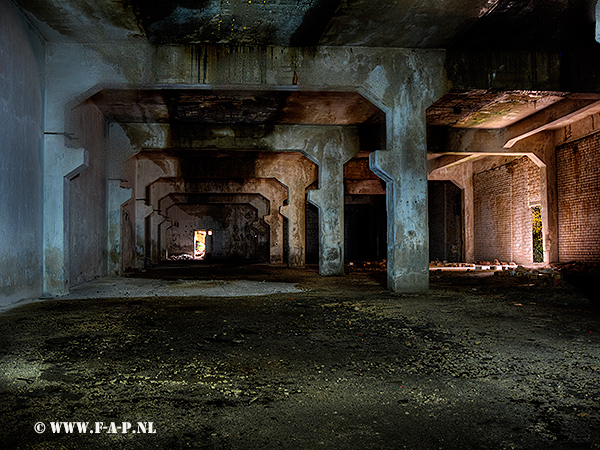
In order to click on shelf in this screenshot , I will do `click(383, 160)`, `click(318, 194)`, `click(283, 211)`, `click(264, 219)`, `click(255, 227)`, `click(167, 225)`, `click(160, 219)`, `click(150, 207)`, `click(128, 194)`, `click(73, 160)`.